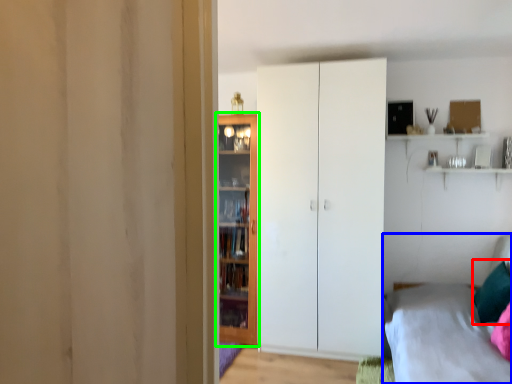
Question: Which is nearer to the pillow (highlighted by a red box)? bed (highlighted by a blue box) or door (highlighted by a green box).

Choices:
 (A) bed
 (B) door

Answer: (A)